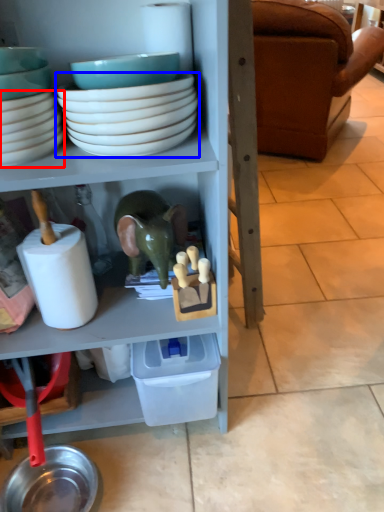
Question: Which point is further to the camera, bowl (highlighted by a red box) or bowl (highlighted by a blue box)?

Choices:
 (A) bowl
 (B) bowl

Answer: (A)